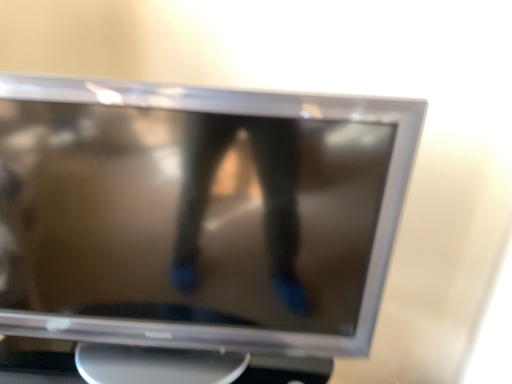
Question: Should I look upward or downward to see satin silver monitor at center?

Choices:
 (A) down
 (B) up

Answer: (A)